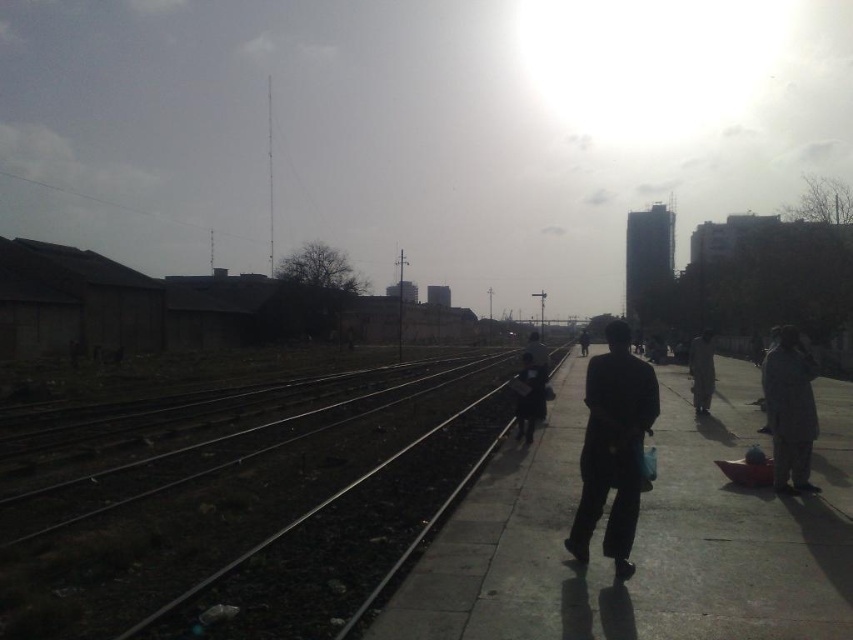
Question: Which object appears farthest from the camera in this image?

Choices:
 (A) dark gray fabric coat at right
 (B) matte black jacket at center
 (C) dark gray suit at center
 (D) dark blue jacket at center

Answer: (C)

Question: Is dark concrete pavement at center in front of black fabric jacket at center?

Choices:
 (A) yes
 (B) no

Answer: (A)

Question: Does dark gray fabric pants at center have a greater width compared to matte black jacket at center?

Choices:
 (A) no
 (B) yes

Answer: (A)

Question: Which point appears closest to the camera in this image?

Choices:
 (A) (651, 525)
 (B) (544, 401)
 (C) (581, 339)

Answer: (A)

Question: Where is dark gray fabric coat at right located in relation to matte black jacket at center in the image?

Choices:
 (A) left
 (B) right

Answer: (A)

Question: Among these points, which one is nearest to the camera?

Choices:
 (A) (694, 385)
 (B) (796, 477)

Answer: (B)